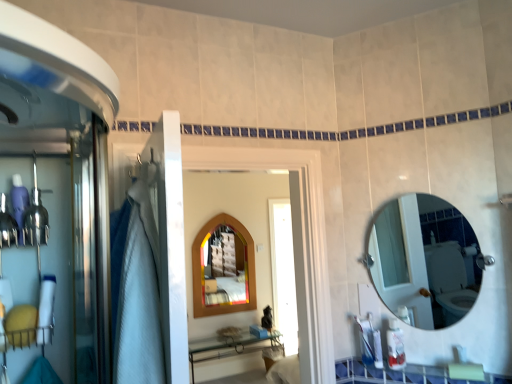
Locate an element on the screen. vacant space underneath clear glass mirror at upper right, which ranks as the 2th mirror in back-to-front order (from a real-world perspective) is located at coordinates (434, 365).